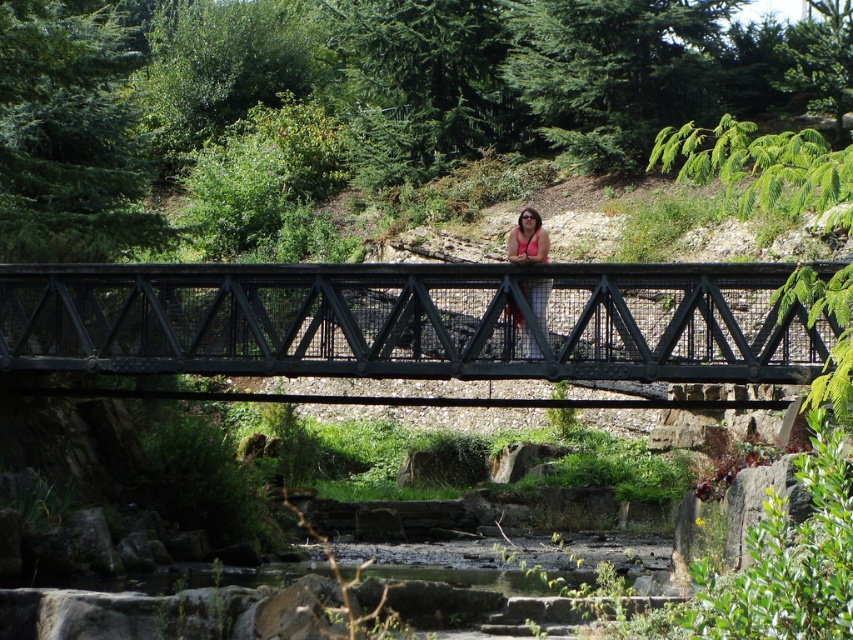
Can you confirm if black metal footbridge at center is smaller than pink fabric at center?

No.

Does point (100, 269) come behind point (531, 298)?

Yes, point (100, 269) is farther from viewer.

At what (x,y) coordinates should I click in order to perform the action: click on black metal footbridge at center. Please return your answer as a coordinate pair (x, y). The width and height of the screenshot is (853, 640). Looking at the image, I should click on (409, 321).